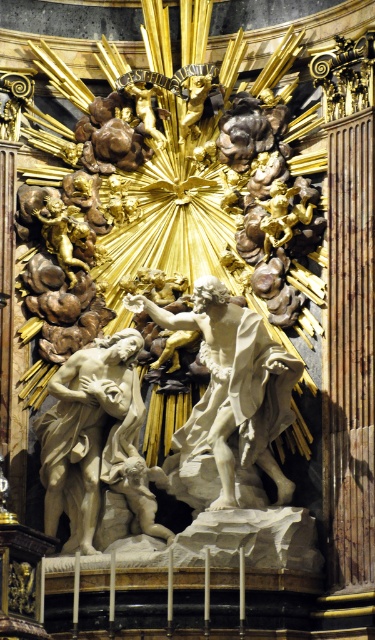
Identify the location of white marble statue at center. The height and width of the screenshot is (640, 375). (229, 396).

How much distance is there between white marble statue at center and gold polished statue at upper center?

white marble statue at center and gold polished statue at upper center are 21.51 meters apart from each other.

Between point (238, 404) and point (192, 88), which one is positioned behind?

Point (192, 88)

This screenshot has width=375, height=640. In order to click on white marble statue at center in this screenshot , I will do (229, 396).